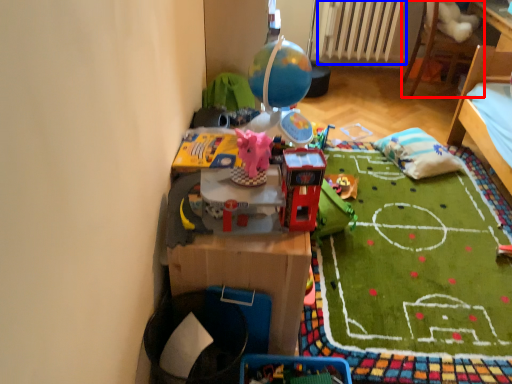
Question: Which of the following is the closest to the observer, furniture (highlighted by a red box) or radiator (highlighted by a blue box)?

Choices:
 (A) furniture
 (B) radiator

Answer: (A)